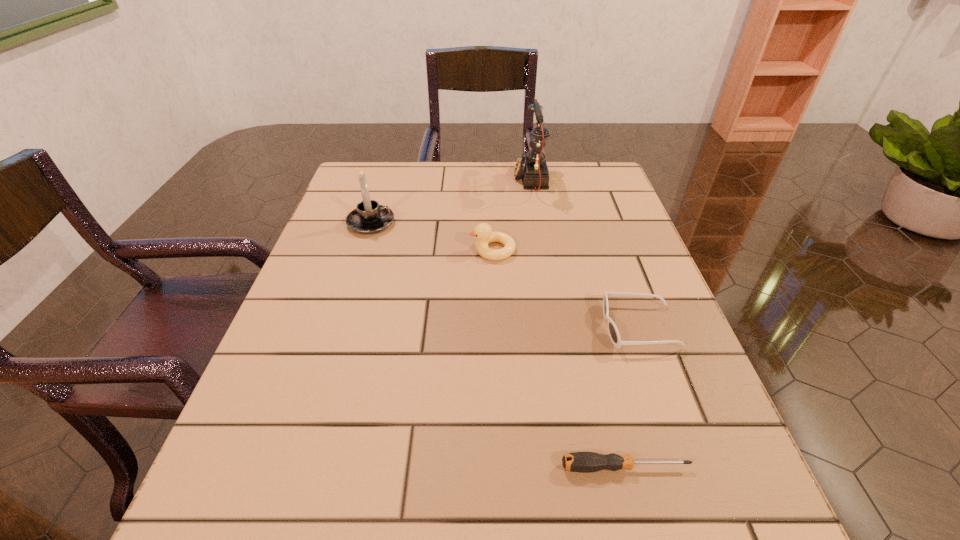
This screenshot has height=540, width=960. Find the location of `vacant space located on the dial of the telephone`. vacant space located on the dial of the telephone is located at coordinates (427, 180).

This screenshot has height=540, width=960. What are the coordinates of `free space located on the dial of the telephone` in the screenshot? It's located at (464, 180).

Where is `vacant region located 0.330m on the dial of the telephone`? The width and height of the screenshot is (960, 540). vacant region located 0.330m on the dial of the telephone is located at coordinates (395, 180).

Locate an element on the screen. This screenshot has height=540, width=960. vacant region located with a handle on the side of the fourth nearest object is located at coordinates (436, 223).

The height and width of the screenshot is (540, 960). Identify the location of vacant space located at the beak of the third tallest object. (336, 250).

Where is `vacant point located 0.090m at the beak of the third tallest object`? vacant point located 0.090m at the beak of the third tallest object is located at coordinates (429, 250).

Identify the location of free region located 0.220m at the beak of the third tallest object. This screenshot has width=960, height=540. (372, 250).

Find the location of `blank space located 0.140m with the lenses of the fourth tallest object facing outward`. blank space located 0.140m with the lenses of the fourth tallest object facing outward is located at coordinates (528, 327).

Identify the location of free point located 0.350m with the lenses of the fourth tallest object facing outward. Image resolution: width=960 pixels, height=540 pixels. (415, 327).

Where is `vacant space located with the lenses of the fourth tallest object facing outward`? The height and width of the screenshot is (540, 960). vacant space located with the lenses of the fourth tallest object facing outward is located at coordinates (507, 327).